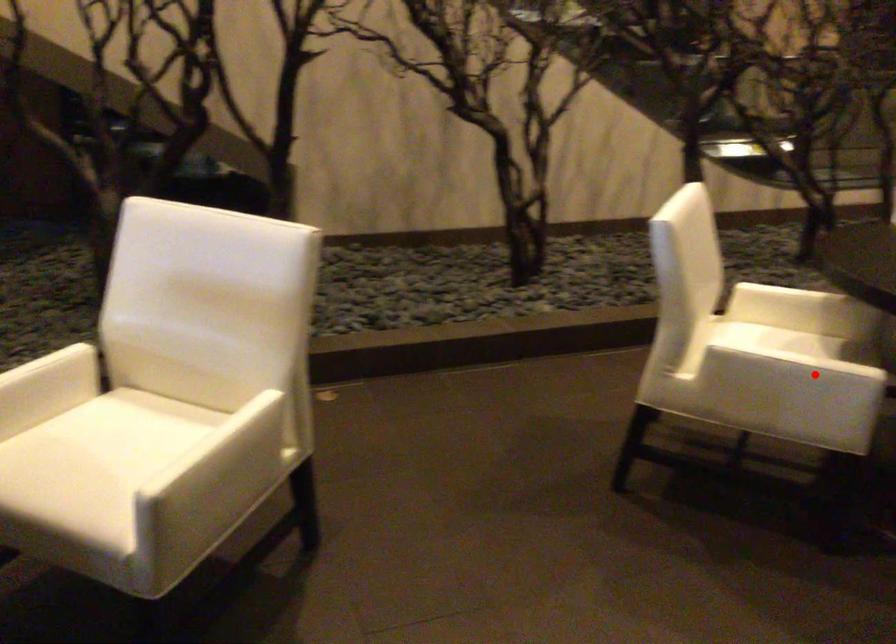
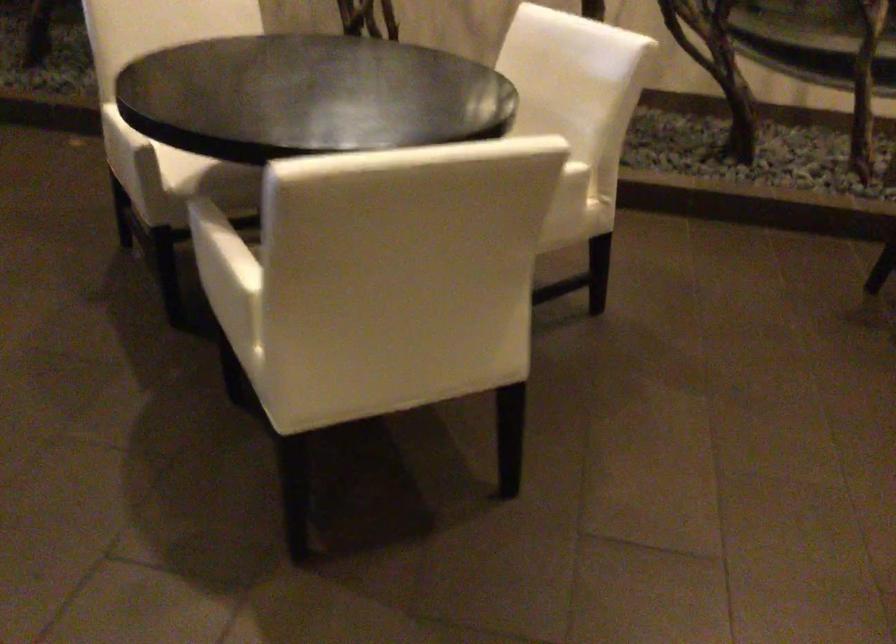
Locate, in the second image, the point that corresponds to the highlighted location in the first image.

(118, 138)